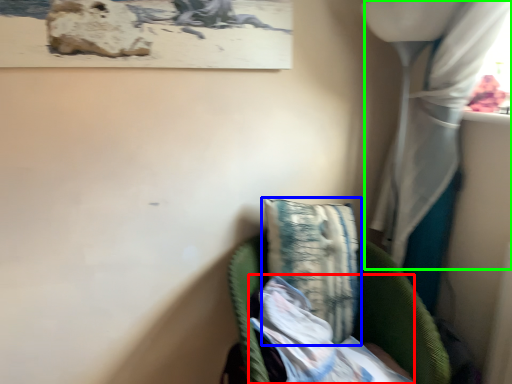
Question: Which is farther away from wrapping paper (highlighted by a red box)? pillow (highlighted by a blue box) or curtain (highlighted by a green box)?

Choices:
 (A) pillow
 (B) curtain

Answer: (B)